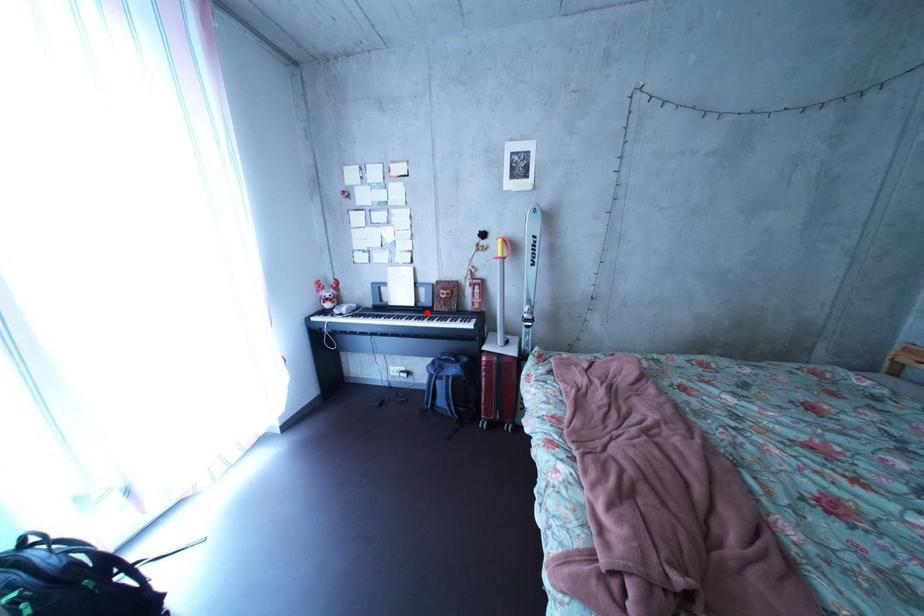
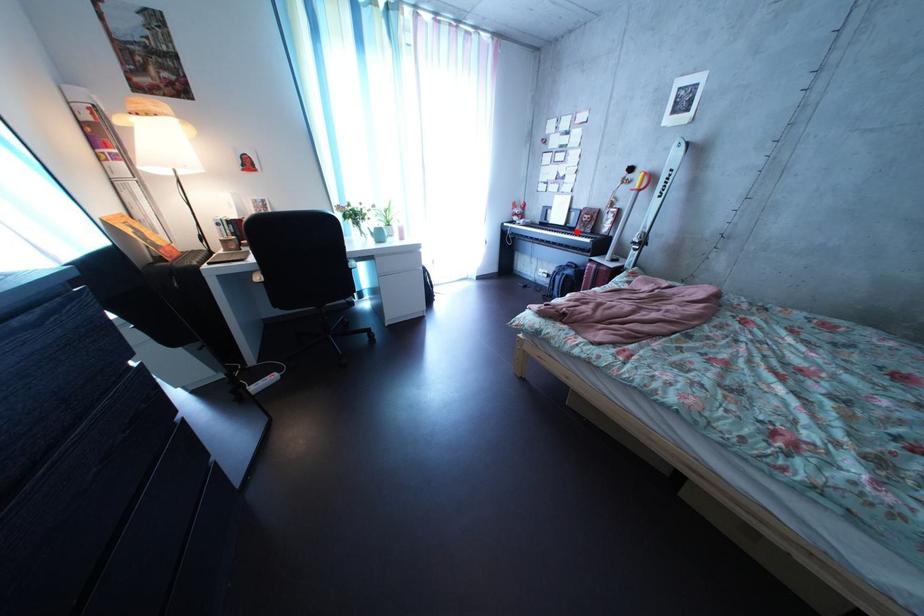
Consider the image. I am providing you with two images of the same scene from different viewpoints. A red point is marked on the first image and another point is marked on the second image. Is the red point in image1 aligned with the point shown in image2?

Yes